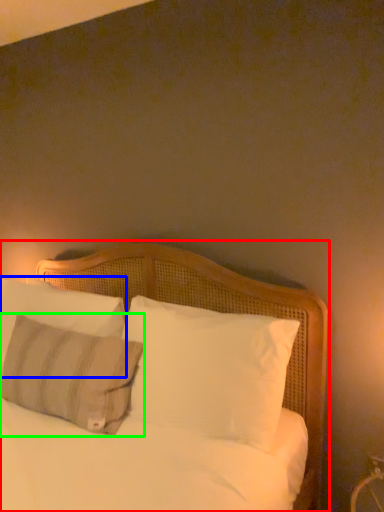
Question: Which is nearer to the bed (highlighted by a red box)? pillow (highlighted by a blue box) or pillow (highlighted by a green box).

Choices:
 (A) pillow
 (B) pillow

Answer: (A)